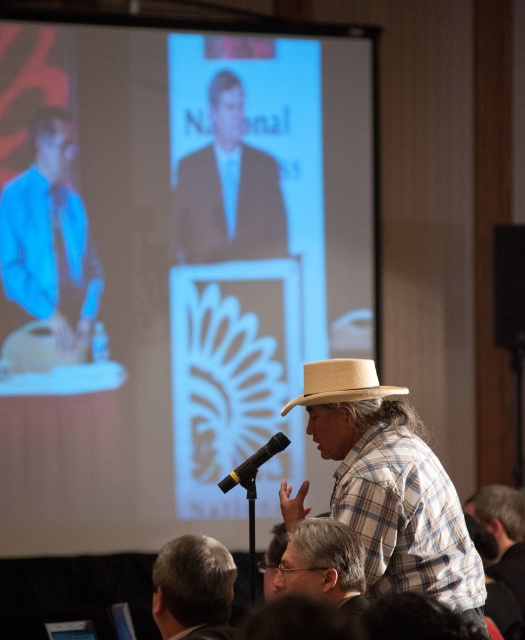
Based on the scene description, where exactly is the matte black suit at center located in the image?

The matte black suit at center is located at point 0.297 on the x axis and 0.434 on the y axis.

In the scene shown: You are organizing a small conference and need to place a decorative item on the podium. The podium has limited vertical space. You have both the clear plastic glasses at center and the black matte microphone at center. Which item should you choose to ensure it fits within the height constraints?

The black matte microphone at center should be chosen because it has a smaller height compared to the clear plastic glasses at center, making it more suitable for the limited vertical space on the podium.